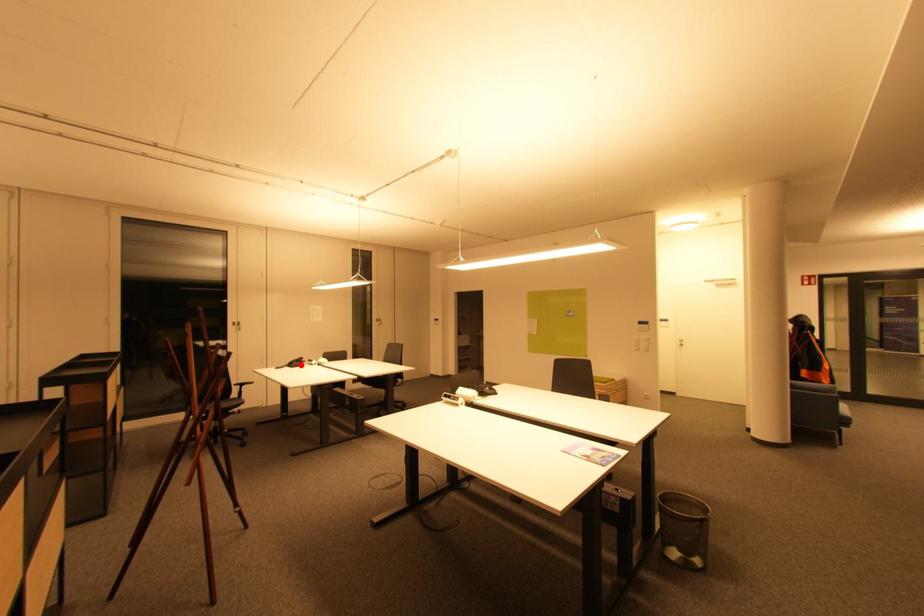
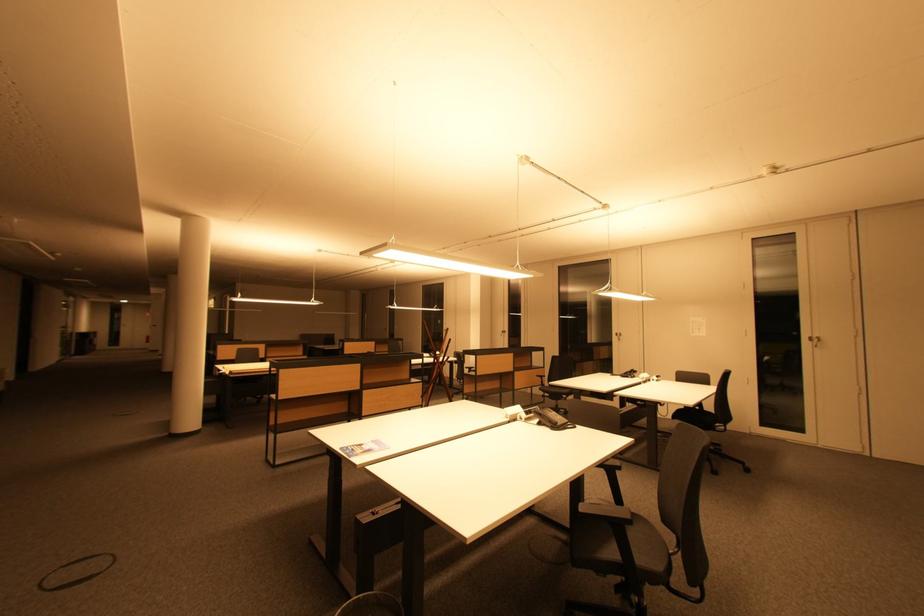
Question: I am providing you with two images of the same scene from different viewpoints. A red point is shown in image1. For the corresponding object point in image2, is it positioned nearer or farther from the camera?

Choices:
 (A) Nearer
 (B) Farther

Answer: (A)